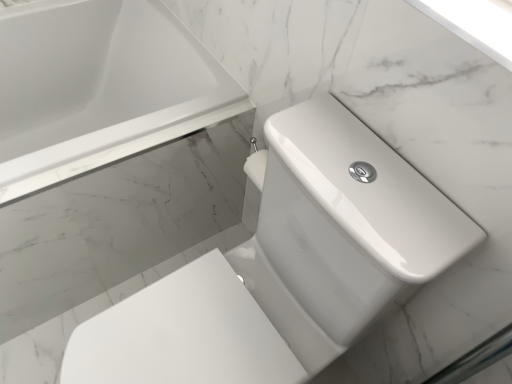
Question: Does white glossy toilet at center-right turn towards white glossy bathtub at upper left?

Choices:
 (A) no
 (B) yes

Answer: (A)

Question: Is white glossy toilet at center-right surrounding white glossy bathtub at upper left?

Choices:
 (A) no
 (B) yes

Answer: (A)

Question: Considering the relative sizes of white glossy toilet at center-right and white glossy bathtub at upper left in the image provided, is white glossy toilet at center-right thinner than white glossy bathtub at upper left?

Choices:
 (A) no
 (B) yes

Answer: (A)

Question: Are white glossy toilet at center-right and white glossy bathtub at upper left far apart?

Choices:
 (A) yes
 (B) no

Answer: (B)

Question: Is white glossy toilet at center-right wider than white glossy bathtub at upper left?

Choices:
 (A) no
 (B) yes

Answer: (B)

Question: Does white glossy toilet at center-right have a smaller size compared to white glossy bathtub at upper left?

Choices:
 (A) yes
 (B) no

Answer: (A)

Question: From the image's perspective, is white glossy bathtub at upper left located above white glossy toilet at center-right?

Choices:
 (A) no
 (B) yes

Answer: (B)

Question: Is white glossy bathtub at upper left at the right side of white glossy toilet at center-right?

Choices:
 (A) no
 (B) yes

Answer: (A)

Question: Is white glossy bathtub at upper left to the left of white glossy toilet at center-right from the viewer's perspective?

Choices:
 (A) no
 (B) yes

Answer: (B)

Question: Is white glossy bathtub at upper left not within white glossy toilet at center-right?

Choices:
 (A) no
 (B) yes

Answer: (B)

Question: Is white glossy bathtub at upper left positioned with its back to white glossy toilet at center-right?

Choices:
 (A) yes
 (B) no

Answer: (B)

Question: Considering the relative positions of white glossy bathtub at upper left and white glossy toilet at center-right in the image provided, is white glossy bathtub at upper left in front of white glossy toilet at center-right?

Choices:
 (A) no
 (B) yes

Answer: (A)

Question: Is white glossy bathtub at upper left wider or thinner than white glossy toilet at center-right?

Choices:
 (A) wide
 (B) thin

Answer: (B)